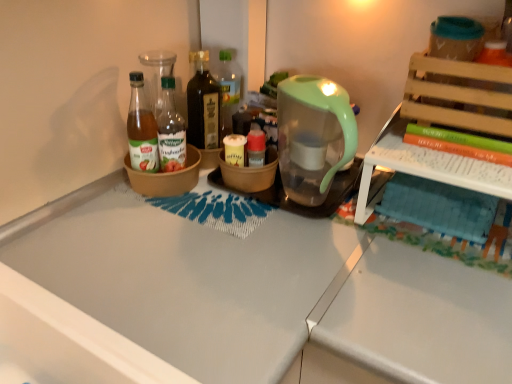
Question: Is brown ceramic bowl at center, acting as the second bowl starting from the right, smaller than brown matte bowl at center, acting as the 2th bowl starting from the left?

Choices:
 (A) yes
 (B) no

Answer: (B)

Question: Is brown ceramic bowl at center, placed as the 1th bowl when sorted from left to right, shorter than brown matte bowl at center, acting as the 2th bowl starting from the left?

Choices:
 (A) no
 (B) yes

Answer: (B)

Question: Is brown ceramic bowl at center, acting as the second bowl starting from the right, in front of brown matte bowl at center, which is the 1th bowl from right to left?

Choices:
 (A) yes
 (B) no

Answer: (A)

Question: From a real-world perspective, is brown ceramic bowl at center, acting as the second bowl starting from the right, on brown matte bowl at center, which is the 1th bowl from right to left?

Choices:
 (A) no
 (B) yes

Answer: (B)

Question: Does brown ceramic bowl at center, placed as the 1th bowl when sorted from left to right, have a larger size compared to brown matte bowl at center, acting as the 2th bowl starting from the left?

Choices:
 (A) yes
 (B) no

Answer: (A)

Question: Is brown ceramic bowl at center, placed as the 1th bowl when sorted from left to right, aimed at brown matte bowl at center, which is the 1th bowl from right to left?

Choices:
 (A) yes
 (B) no

Answer: (B)

Question: Is dark brown glass bottle at center, placed as the 2th bottle when sorted from left to right, shorter than green matte book at upper right?

Choices:
 (A) no
 (B) yes

Answer: (A)

Question: Is dark brown glass bottle at center, the second bottle in the right-to-left sequence, aimed at green matte book at upper right?

Choices:
 (A) no
 (B) yes

Answer: (A)

Question: Is dark brown glass bottle at center, the second bottle in the right-to-left sequence, oriented away from green matte book at upper right?

Choices:
 (A) yes
 (B) no

Answer: (B)

Question: Is dark brown glass bottle at center, placed as the 2th bottle when sorted from left to right, closer to the viewer compared to green matte book at upper right?

Choices:
 (A) yes
 (B) no

Answer: (B)

Question: Is dark brown glass bottle at center, placed as the 2th bottle when sorted from left to right, placed right next to green matte book at upper right?

Choices:
 (A) no
 (B) yes

Answer: (A)

Question: Considering the relative sizes of dark brown glass bottle at center, the second bottle in the right-to-left sequence, and green matte book at upper right in the image provided, is dark brown glass bottle at center, the second bottle in the right-to-left sequence, taller than green matte book at upper right?

Choices:
 (A) no
 (B) yes

Answer: (B)

Question: Is brown ceramic bowl at center, acting as the second bowl starting from the right, a part of translucent glass bottle at center, which ranks as the first bottle in right-to-left order?

Choices:
 (A) no
 (B) yes

Answer: (A)